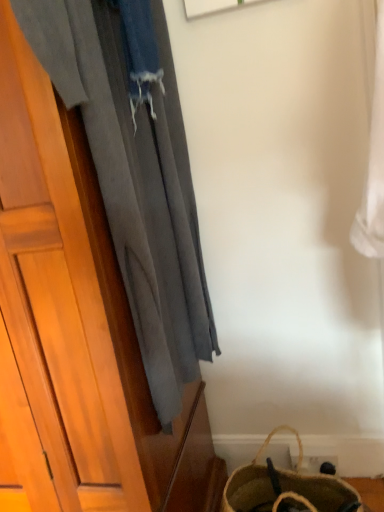
Question: Which is correct: brown woven bag at lower right is inside gray fabric curtain at left, or outside of it?

Choices:
 (A) inside
 (B) outside

Answer: (B)

Question: Visually, is brown woven bag at lower right positioned to the left or to the right of gray fabric curtain at left?

Choices:
 (A) left
 (B) right

Answer: (B)

Question: Looking at the image, does brown woven bag at lower right seem bigger or smaller compared to gray fabric curtain at left?

Choices:
 (A) small
 (B) big

Answer: (A)

Question: Based on their positions, is gray fabric curtain at left located to the left or right of brown woven bag at lower right?

Choices:
 (A) left
 (B) right

Answer: (A)

Question: From a real-world perspective, is gray fabric curtain at left physically located above or below brown woven bag at lower right?

Choices:
 (A) above
 (B) below

Answer: (A)

Question: Considering the positions of point (175, 163) and point (266, 474), is point (175, 163) closer or farther from the camera than point (266, 474)?

Choices:
 (A) farther
 (B) closer

Answer: (B)

Question: Is gray fabric curtain at left bigger or smaller than brown woven bag at lower right?

Choices:
 (A) big
 (B) small

Answer: (A)